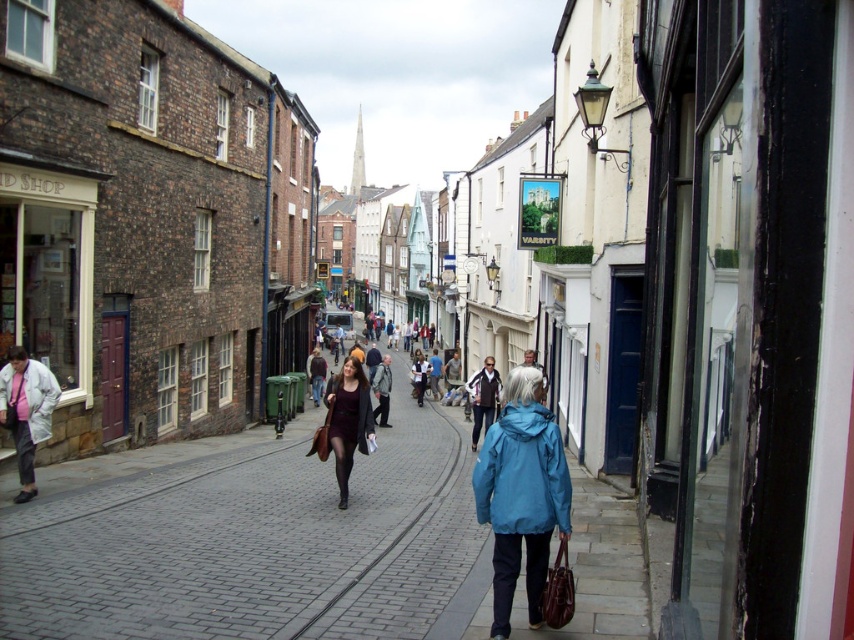
Can you confirm if gray brick pavement at center is bigger than matte black coat at center?

Incorrect, gray brick pavement at center is not larger than matte black coat at center.

Does gray brick pavement at center appear on the left side of matte black coat at center?

In fact, gray brick pavement at center is to the right of matte black coat at center.

Is point (59, 481) behind point (367, 435)?

Yes, it is behind point (367, 435).

At what (x,y) coordinates should I click in order to perform the action: click on gray brick pavement at center. Please return your answer as a coordinate pair (x, y). The image size is (854, 640). Looking at the image, I should click on (253, 540).

Can you confirm if teal matte jacket at center is thinner than matte black coat at center?

Yes, teal matte jacket at center is thinner than matte black coat at center.

Who is taller, teal matte jacket at center or matte black coat at center?

matte black coat at center

This screenshot has height=640, width=854. Identify the location of teal matte jacket at center. (521, 493).

Find the location of a particular element. This screenshot has height=640, width=854. teal matte jacket at center is located at coordinates (521, 493).

Looking at this image, is gray brick pavement at center thinner than teal matte jacket at center?

In fact, gray brick pavement at center might be wider than teal matte jacket at center.

Does gray brick pavement at center appear under teal matte jacket at center?

Yes, gray brick pavement at center is below teal matte jacket at center.

Is point (484, 609) positioned in front of point (504, 602)?

No, (484, 609) is further to viewer.

This screenshot has height=640, width=854. I want to click on gray brick pavement at center, so click(x=253, y=540).